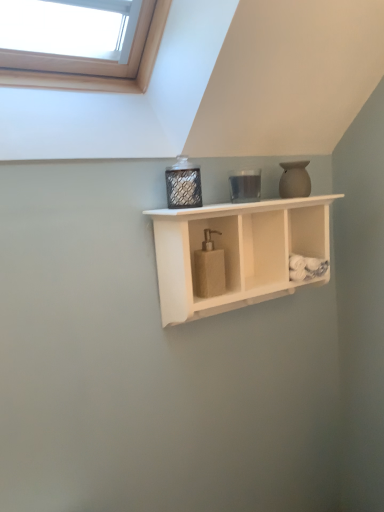
Question: Is matte beige vase at upper right far away from beige textured soap dispenser at center?

Choices:
 (A) yes
 (B) no

Answer: (B)

Question: Can you confirm if matte beige vase at upper right is taller than beige textured soap dispenser at center?

Choices:
 (A) yes
 (B) no

Answer: (B)

Question: Is matte beige vase at upper right bigger than beige textured soap dispenser at center?

Choices:
 (A) yes
 (B) no

Answer: (B)

Question: Can you confirm if matte beige vase at upper right is positioned to the left of beige textured soap dispenser at center?

Choices:
 (A) no
 (B) yes

Answer: (A)

Question: Is matte beige vase at upper right to the right of beige textured soap dispenser at center from the viewer's perspective?

Choices:
 (A) yes
 (B) no

Answer: (A)

Question: From a real-world perspective, is matte beige vase at upper right positioned under beige textured soap dispenser at center based on gravity?

Choices:
 (A) no
 (B) yes

Answer: (A)

Question: Does metallic mesh container at center have a lesser height compared to beige textured soap dispenser at center?

Choices:
 (A) no
 (B) yes

Answer: (B)

Question: Can we say metallic mesh container at center lies outside beige textured soap dispenser at center?

Choices:
 (A) no
 (B) yes

Answer: (B)

Question: From a real-world perspective, does metallic mesh container at center sit lower than beige textured soap dispenser at center?

Choices:
 (A) yes
 (B) no

Answer: (B)

Question: Can you confirm if metallic mesh container at center is positioned to the left of beige textured soap dispenser at center?

Choices:
 (A) yes
 (B) no

Answer: (A)

Question: Is metallic mesh container at center further to camera compared to beige textured soap dispenser at center?

Choices:
 (A) yes
 (B) no

Answer: (B)

Question: Does metallic mesh container at center have a greater width compared to beige textured soap dispenser at center?

Choices:
 (A) no
 (B) yes

Answer: (B)

Question: Is metallic mesh container at center in contact with matte beige vase at upper right?

Choices:
 (A) yes
 (B) no

Answer: (B)